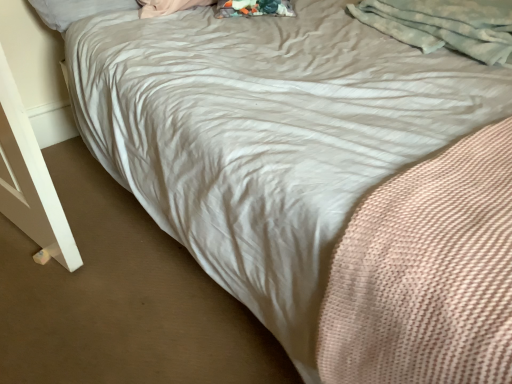
Question: Is white soft pillow at upper left to the right of light gray fluffy blanket at upper right from the viewer's perspective?

Choices:
 (A) no
 (B) yes

Answer: (A)

Question: Does white soft pillow at upper left have a smaller size compared to light gray fluffy blanket at upper right?

Choices:
 (A) yes
 (B) no

Answer: (A)

Question: Considering the relative positions of white soft pillow at upper left and light gray fluffy blanket at upper right in the image provided, is white soft pillow at upper left in front of light gray fluffy blanket at upper right?

Choices:
 (A) no
 (B) yes

Answer: (A)

Question: Can you confirm if white soft pillow at upper left is thinner than light gray fluffy blanket at upper right?

Choices:
 (A) no
 (B) yes

Answer: (B)

Question: Does white soft pillow at upper left appear on the left side of light gray fluffy blanket at upper right?

Choices:
 (A) no
 (B) yes

Answer: (B)

Question: From a real-world perspective, is white soft pillow at upper left physically below light gray fluffy blanket at upper right?

Choices:
 (A) no
 (B) yes

Answer: (B)

Question: Is light gray fluffy blanket at upper right to the right of white soft pillow at upper left from the viewer's perspective?

Choices:
 (A) no
 (B) yes

Answer: (B)

Question: Would you consider light gray fluffy blanket at upper right to be distant from white soft pillow at upper left?

Choices:
 (A) yes
 (B) no

Answer: (B)

Question: Is light gray fluffy blanket at upper right bigger than white soft pillow at upper left?

Choices:
 (A) yes
 (B) no

Answer: (A)

Question: Considering the relative sizes of light gray fluffy blanket at upper right and white soft pillow at upper left in the image provided, is light gray fluffy blanket at upper right shorter than white soft pillow at upper left?

Choices:
 (A) no
 (B) yes

Answer: (A)

Question: Is light gray fluffy blanket at upper right aimed at white soft pillow at upper left?

Choices:
 (A) yes
 (B) no

Answer: (B)

Question: From the image's perspective, is light gray fluffy blanket at upper right located above white soft pillow at upper left?

Choices:
 (A) no
 (B) yes

Answer: (A)

Question: Visually, is light gray fluffy blanket at upper right positioned to the left or to the right of white soft pillow at upper left?

Choices:
 (A) left
 (B) right

Answer: (B)